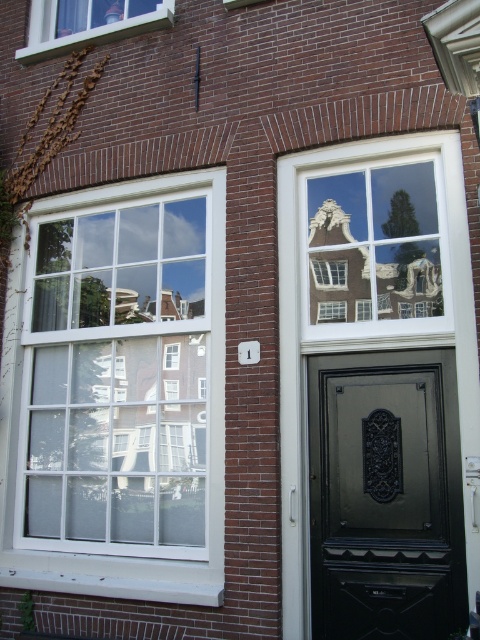
Measure the distance from white glass window at upper left to matte white window at upper left.

white glass window at upper left is 2.66 meters from matte white window at upper left.

Is point (180, 227) positioned in front of point (142, 4)?

Yes.

This screenshot has height=640, width=480. I want to click on white glass window at upper left, so click(117, 394).

In order to click on matte black door at center in this screenshot , I will do `click(385, 497)`.

Where is `matte black door at center`? matte black door at center is located at coordinates (385, 497).

What do you see at coordinates (117, 394) in the screenshot?
I see `white glass window at upper left` at bounding box center [117, 394].

Between white glass window at upper left and matte black door at center, which one has less height?

matte black door at center is shorter.

Does point (3, 556) lie in front of point (393, 512)?

No, (3, 556) is further to viewer.

At what (x,y) coordinates should I click in order to perform the action: click on white glass window at upper left. Please return your answer as a coordinate pair (x, y). This screenshot has height=640, width=480. Looking at the image, I should click on (117, 394).